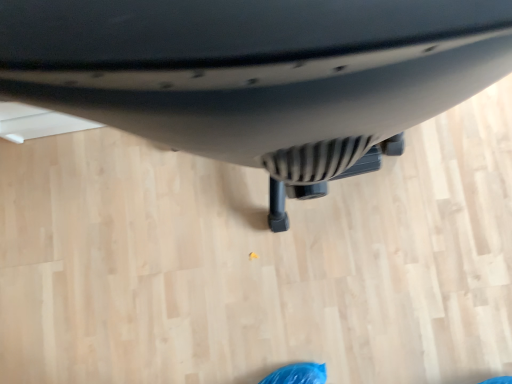
What do you see at coordinates (257, 74) in the screenshot?
I see `matte black chair at center` at bounding box center [257, 74].

The width and height of the screenshot is (512, 384). Find the location of `matte black chair at center`. matte black chair at center is located at coordinates (257, 74).

What are the coordinates of `matte black chair at center` in the screenshot? It's located at (257, 74).